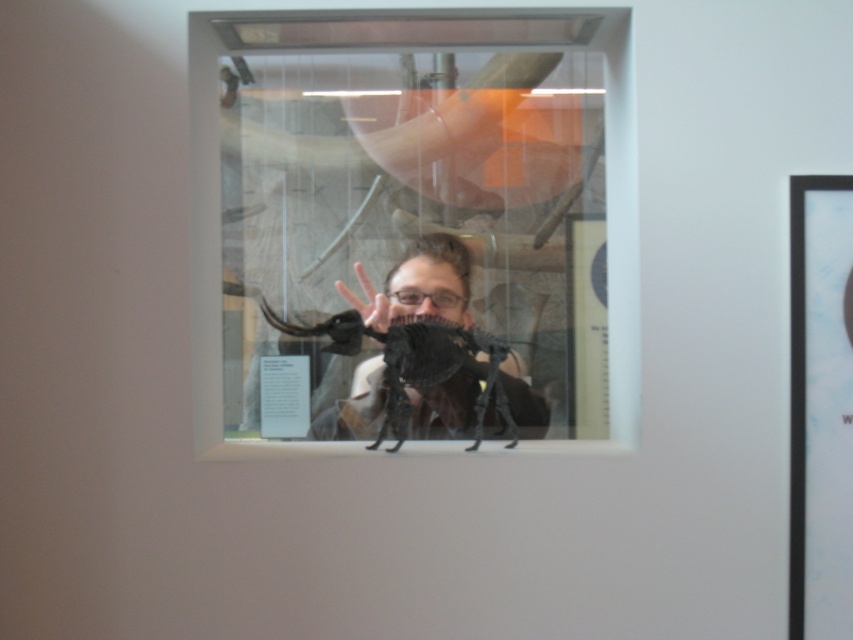
Question: Is black matte spider at center positioned behind matte black hand at center?

Choices:
 (A) yes
 (B) no

Answer: (B)

Question: Is black matte mirror at center to the right of black matte spider at center from the viewer's perspective?

Choices:
 (A) yes
 (B) no

Answer: (B)

Question: Can you confirm if black matte mirror at center is positioned to the left of black matte spider at center?

Choices:
 (A) yes
 (B) no

Answer: (A)

Question: Which is nearer to the matte black hand at center?

Choices:
 (A) black matte mirror at center
 (B) black matte spider at center

Answer: (A)

Question: Which object is closer to the camera taking this photo?

Choices:
 (A) black matte mirror at center
 (B) matte black hand at center
 (C) black matte spider at center

Answer: (C)

Question: Among these points, which one is nearest to the camera?

Choices:
 (A) (312, 202)
 (B) (367, 312)
 (C) (403, 385)

Answer: (C)